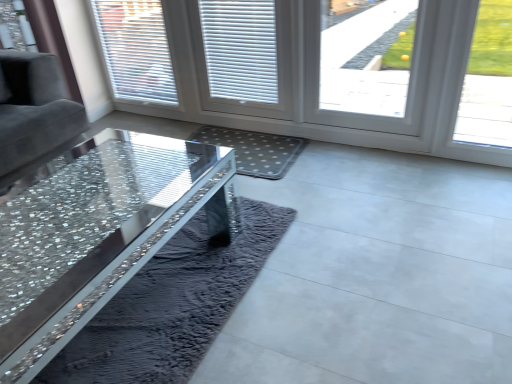
Locate an element on the screen. The image size is (512, 384). white plastic blinds at center is located at coordinates 240,49.

In order to face smooth concrete floor at center, should I rotate leftwards or rightwards?

Turn left by 9.725 degrees to look at smooth concrete floor at center.

What do you see at coordinates (136, 50) in the screenshot?
I see `white textured blinds at upper left, positioned as the second window in right-to-left order` at bounding box center [136, 50].

The image size is (512, 384). I want to click on white plastic blinds at center, so click(240, 49).

Considering the sizes of smooth concrete floor at center and gray dotted mat at center in the image, is smooth concrete floor at center wider or thinner than gray dotted mat at center?

In the image, smooth concrete floor at center appears to be wider than gray dotted mat at center.

Is smooth concrete floor at center facing towards gray dotted mat at center?

No, smooth concrete floor at center does not turn towards gray dotted mat at center.

Based on their positions, is smooth concrete floor at center located to the left or right of gray dotted mat at center?

smooth concrete floor at center is to the left of gray dotted mat at center.

Is point (337, 324) more distant than point (195, 139)?

No.

Is transparent glass window at upper right, which is counted as the second window, starting from the left, at the left side of white plastic screen door at center?

No.

From a real-world perspective, between transparent glass window at upper right, which is counted as the second window, starting from the left, and white plastic screen door at center, who is vertically higher?

From a 3D spatial view, white plastic screen door at center is above.

Based on the photo, do you think transparent glass window at upper right, the first window viewed from the front, is within white plastic screen door at center, or outside of it?

transparent glass window at upper right, the first window viewed from the front, lies outside white plastic screen door at center.

Is transparent glass window at upper right, the first window viewed from the front, oriented towards white plastic screen door at center?

No, transparent glass window at upper right, the first window viewed from the front, is not turned towards white plastic screen door at center.

Consider the image. Does white textured blinds at upper left, positioned as the second window in right-to-left order, turn towards crystal glass table at center?

No, white textured blinds at upper left, positioned as the second window in right-to-left order, is not oriented towards crystal glass table at center.

Is crystal glass table at center a part of white textured blinds at upper left, marked as the 1th window in a left-to-right arrangement?

No, crystal glass table at center is not a part of white textured blinds at upper left, marked as the 1th window in a left-to-right arrangement.

From the image's perspective, relative to crystal glass table at center, is white textured blinds at upper left, which appears as the second window when viewed from the front, above or below?

white textured blinds at upper left, which appears as the second window when viewed from the front, is above crystal glass table at center.

Considering the points (121, 95) and (182, 225), which point is behind, point (121, 95) or point (182, 225)?

The point (121, 95) is farther from the camera.

Is there a large distance between white plastic screen door at center and smooth concrete floor at center?

Yes, white plastic screen door at center and smooth concrete floor at center are quite far apart.

Measure the distance between white plastic screen door at center and smooth concrete floor at center.

1.22 meters.

Considering the sizes of white plastic screen door at center and smooth concrete floor at center in the image, is white plastic screen door at center bigger or smaller than smooth concrete floor at center?

white plastic screen door at center is smaller than smooth concrete floor at center.

From a real-world perspective, is white plastic screen door at center on top of smooth concrete floor at center?

Indeed, from a real-world perspective, white plastic screen door at center stands above smooth concrete floor at center.

Considering the points (471, 300) and (347, 28), which point is behind, point (471, 300) or point (347, 28)?

The point (347, 28) is farther.

Is smooth concrete floor at center closer to the viewer compared to transparent glass window at upper right, which is counted as the second window, starting from the left?

That is True.

Which of these two, smooth concrete floor at center or transparent glass window at upper right, the first window viewed from the front, stands taller?

transparent glass window at upper right, the first window viewed from the front.

Can you confirm if smooth concrete floor at center is thinner than transparent glass window at upper right, arranged as the 2th window when viewed from the back?

No.

Looking at their sizes, would you say gray dotted mat at center is wider or thinner than smooth concrete floor at center?

Considering their sizes, gray dotted mat at center looks slimmer than smooth concrete floor at center.

Is gray dotted mat at center in front of or behind smooth concrete floor at center in the image?

Clearly, gray dotted mat at center is behind smooth concrete floor at center.

Is gray dotted mat at center touching smooth concrete floor at center?

No, gray dotted mat at center is not making contact with smooth concrete floor at center.

Is point (375, 336) behind point (272, 87)?

No, it is in front of (272, 87).

Which object is further away from the camera taking this photo, smooth concrete floor at center or white plastic blinds at center?

white plastic blinds at center is behind.

Is smooth concrete floor at center shorter than white plastic blinds at center?

Yes.

I want to click on concrete in front of the gray dotted mat at center, so click(x=377, y=276).

At what (x,y) coordinates should I click in order to perform the action: click on screen door above the transparent glass window at upper right, which is counted as the second window, starting from the left (from a real-world perspective). Please return your answer as a coordinate pair (x, y). This screenshot has height=384, width=512. Looking at the image, I should click on (199, 55).

When comparing their distances from white textured blinds at upper left, which appears as the second window when viewed from the front, does transparent glass window at upper right, arranged as the 2th window when viewed from the back, or gray dotted mat at center seem closer?

gray dotted mat at center.

Estimate the real-world distances between objects in this image. Which object is closer to gray dotted mat at center, smooth concrete floor at center or transparent glass window at upper right, which is the first window from right to left?

Among the two, smooth concrete floor at center is located nearer to gray dotted mat at center.

Based on their spatial positions, is crystal glass table at center or white textured blinds at upper left, marked as the 1th window in a left-to-right arrangement, further from smooth concrete floor at center?

Based on the image, white textured blinds at upper left, marked as the 1th window in a left-to-right arrangement, appears to be further to smooth concrete floor at center.

Based on their spatial positions, is crystal glass table at center or smooth concrete floor at center closer to gray dotted mat at center?

crystal glass table at center.

Estimate the real-world distances between objects in this image. Which object is closer to gray dotted mat at center, white plastic blinds at center or white plastic screen door at center?

The object closer to gray dotted mat at center is white plastic screen door at center.

Which object lies nearer to the anchor point white plastic screen door at center, crystal glass table at center or transparent glass window at upper right, arranged as the 2th window when viewed from the back?

Based on the image, crystal glass table at center appears to be nearer to white plastic screen door at center.

Based on their spatial positions, is transparent glass window at upper right, which is the first window from right to left, or smooth concrete floor at center further from white plastic screen door at center?

transparent glass window at upper right, which is the first window from right to left, is further to white plastic screen door at center.

Considering their positions, is white plastic screen door at center positioned further to transparent glass window at upper right, which is the first window from right to left, than crystal glass table at center?

crystal glass table at center is positioned further to the anchor transparent glass window at upper right, which is the first window from right to left.

This screenshot has width=512, height=384. I want to click on screen door located between smooth concrete floor at center and white textured blinds at upper left, which appears as the second window when viewed from the front, in the depth direction, so click(199, 55).

The width and height of the screenshot is (512, 384). What are the coordinates of `screen door located between white plastic blinds at center and transparent glass window at upper right, which is counted as the second window, starting from the left, in the left-right direction` in the screenshot? It's located at (199, 55).

Where is `window between crystal glass table at center and white plastic screen door at center from front to back`? The width and height of the screenshot is (512, 384). window between crystal glass table at center and white plastic screen door at center from front to back is located at coordinates (357, 69).

Where is `table between smooth concrete floor at center and white plastic blinds at center from front to back`? The height and width of the screenshot is (384, 512). table between smooth concrete floor at center and white plastic blinds at center from front to back is located at coordinates (98, 234).